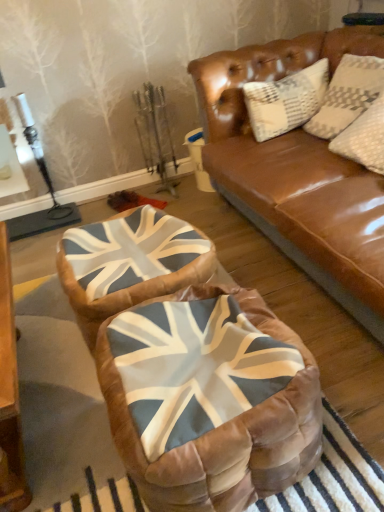
Find the location of `vacant area to the right of union jack fabric swivel chair at center`. vacant area to the right of union jack fabric swivel chair at center is located at coordinates (283, 292).